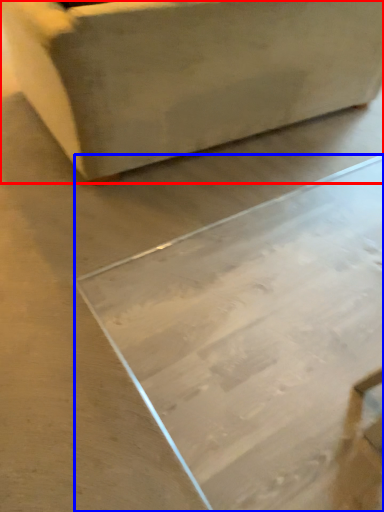
Question: Which object is closer to the camera taking this photo, furniture (highlighted by a red box) or table (highlighted by a blue box)?

Choices:
 (A) furniture
 (B) table

Answer: (B)